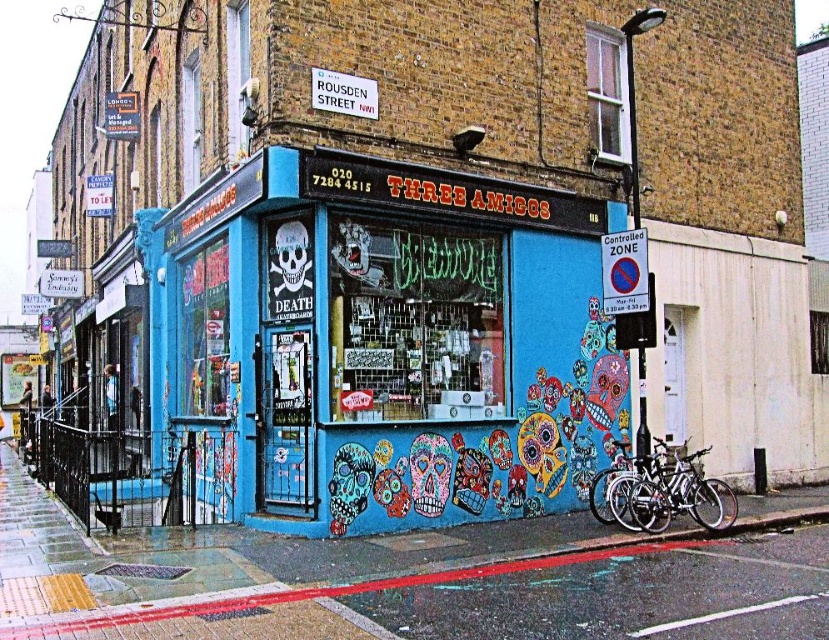
Question: Which point is farther to the camera?

Choices:
 (A) smooth concrete pavement at lower center
 (B) blue painted wall at center

Answer: (B)

Question: Does silver metallic bicycle at lower right have a lesser width compared to matte black skull at center?

Choices:
 (A) no
 (B) yes

Answer: (A)

Question: Which object is closer to the camera taking this photo?

Choices:
 (A) matte black skull at center
 (B) smooth concrete pavement at lower center
 (C) silver metallic bicycle at lower right

Answer: (B)

Question: Can you confirm if blue painted wall at center is thinner than silver metallic bicycle at lower right?

Choices:
 (A) yes
 (B) no

Answer: (A)

Question: Is smooth concrete pavement at lower center positioned in front of matte black skull at center?

Choices:
 (A) no
 (B) yes

Answer: (B)

Question: Which point appears farthest from the camera in this image?

Choices:
 (A) (280, 289)
 (B) (687, 506)

Answer: (B)